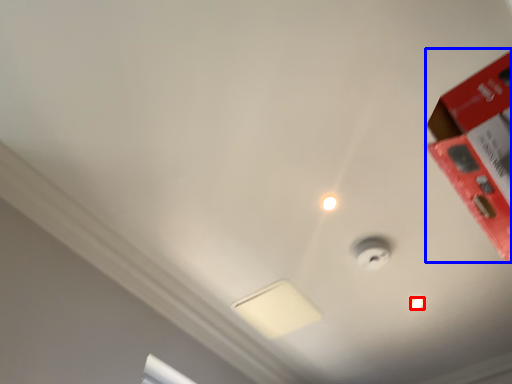
Question: Among these objects, which one is nearest to the camera, light bulb (highlighted by a red box) or box (highlighted by a blue box)?

Choices:
 (A) light bulb
 (B) box

Answer: (B)